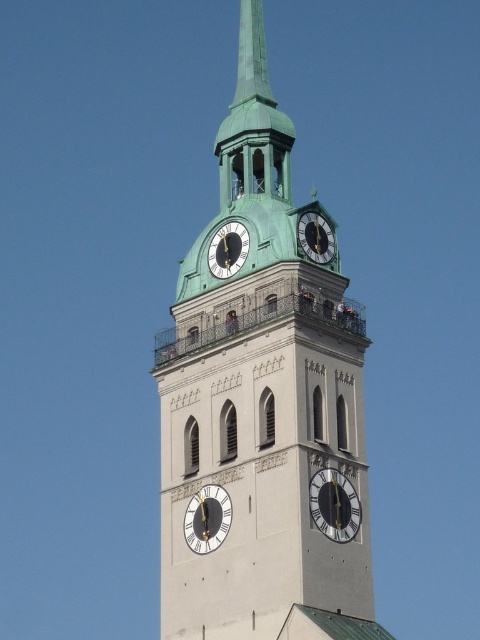
You are standing in front of the clock tower and want to know which clock is closer to the top of the tower. Which one is it? The silver metallic clock at center or the matte black clock at upper center?

The matte black clock at upper center is closer to the top of the tower because it is positioned above the silver metallic clock at center.

You are standing in front of the clock tower and notice two points marked on the tower. The first point is at coordinate point (327, 484) and the second is at point (327, 240). Which point is positioned closer to your current viewpoint?

Point (327, 484) is closer to the viewer than point (327, 240).